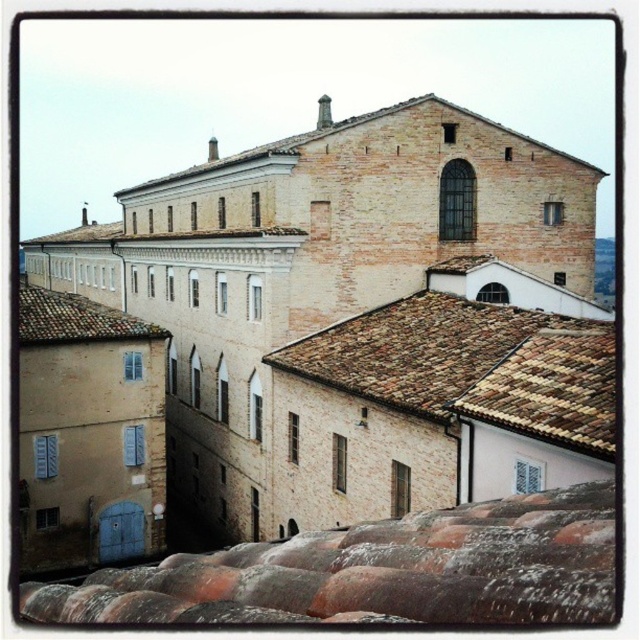
Question: Does terracotta clay tiles at lower center appear over brown tiled roof at upper center?

Choices:
 (A) no
 (B) yes

Answer: (A)

Question: Which is farther from the terracotta clay tiles at lower center?

Choices:
 (A) brown tiled roof at center
 (B) brown tiled roof at upper center
 (C) beige brick church at center
 (D) brown tile roof at left

Answer: (B)

Question: Estimate the real-world distances between objects in this image. Which object is farther from the terracotta clay tiles at lower center?

Choices:
 (A) brown tiled roof at upper center
 (B) beige brick church at center
 (C) brown tile roof at left
 (D) brown tiled roof at center

Answer: (A)

Question: Does brown tiled roof at center appear over brown tiled roof at upper center?

Choices:
 (A) no
 (B) yes

Answer: (A)

Question: Which point is closer to the camera?

Choices:
 (A) (278, 364)
 (B) (440, 122)

Answer: (A)

Question: Is the position of terracotta clay tiles at lower center more distant than that of brown tiled roof at center?

Choices:
 (A) no
 (B) yes

Answer: (A)